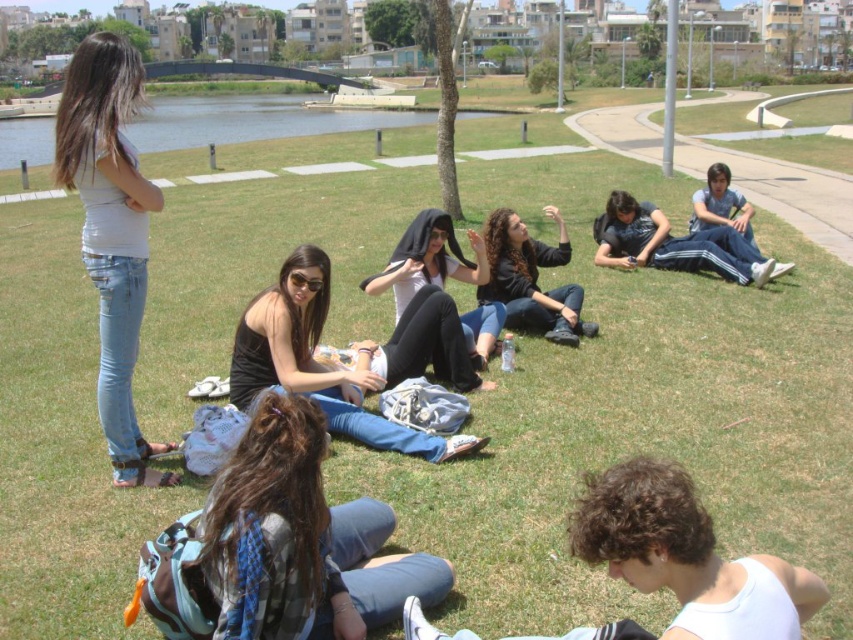
Question: Among these points, which one is nearest to the camera?

Choices:
 (A) (727, 588)
 (B) (482, 273)
 (C) (408, 588)
 (D) (605, 259)

Answer: (A)

Question: In this image, where is light blue denim jeans at left located relative to black matte shirt at center?

Choices:
 (A) below
 (B) above

Answer: (B)

Question: Is black matte hoodie at center above blue jeans at right?

Choices:
 (A) no
 (B) yes

Answer: (A)

Question: Which point is closer to the camera?

Choices:
 (A) (x=648, y=561)
 (B) (x=372, y=545)
 (C) (x=553, y=205)
 (D) (x=55, y=122)

Answer: (A)

Question: Which object is closer to the camera taking this photo?

Choices:
 (A) black matte shirt at center
 (B) denim jeans at lower left

Answer: (B)

Question: Is denim jeans at lower left thinner than white matte tank top at lower right?

Choices:
 (A) no
 (B) yes

Answer: (A)